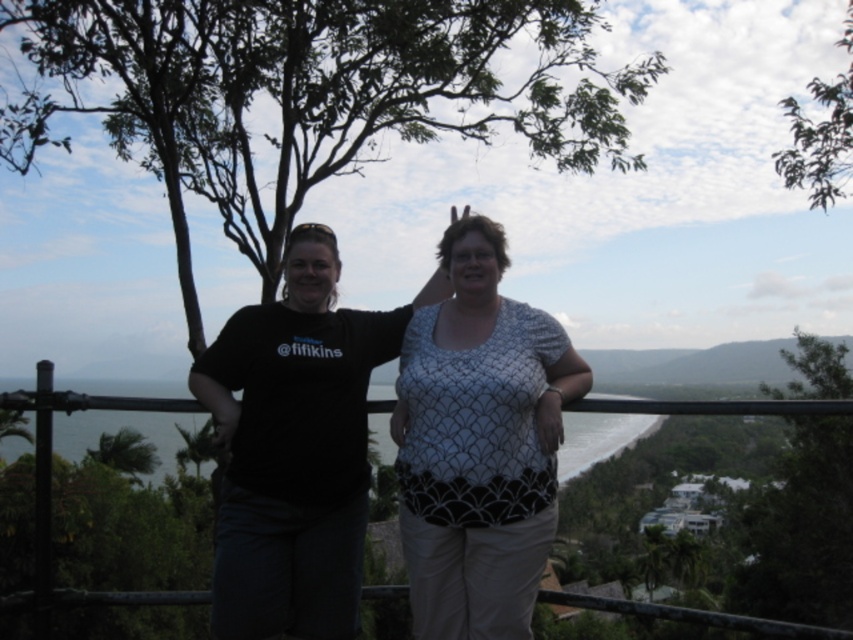
Between black matte t-shirt at center and white textured blouse at center, which one has more height?

white textured blouse at center is taller.

Which is more to the right, black matte t-shirt at center or white textured blouse at center?

From the viewer's perspective, white textured blouse at center appears more on the right side.

Which is in front, point (314, 636) or point (509, 365)?

Point (509, 365) is more forward.

Find the location of `black matte t-shirt at center`. black matte t-shirt at center is located at coordinates (296, 448).

In the scene shown: Is white textured blouse at center to the left of green leafy tree at right from the viewer's perspective?

Indeed, white textured blouse at center is positioned on the left side of green leafy tree at right.

Can you confirm if white textured blouse at center is wider than green leafy tree at right?

No, white textured blouse at center is not wider than green leafy tree at right.

Between point (515, 320) and point (811, 545), which one is positioned behind?

Point (811, 545)

I want to click on white textured blouse at center, so click(479, 444).

Between black matte t-shirt at center and green leafy tree at upper right, which one has less height?

black matte t-shirt at center is shorter.

Is black matte t-shirt at center thinner than green leafy tree at upper right?

Indeed, black matte t-shirt at center has a lesser width compared to green leafy tree at upper right.

What do you see at coordinates (296, 448) in the screenshot?
I see `black matte t-shirt at center` at bounding box center [296, 448].

I want to click on black matte t-shirt at center, so click(x=296, y=448).